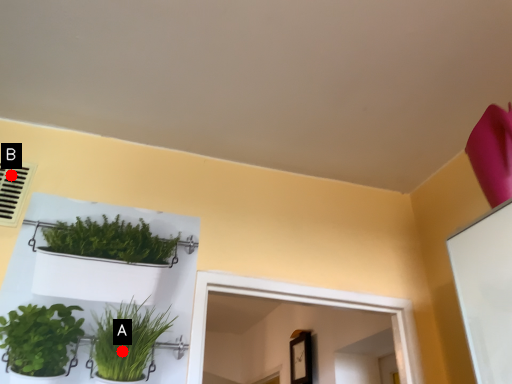
Question: Two points are circled on the image, labeled by A and B beside each circle. Which point is closer to the camera?

Choices:
 (A) A is closer
 (B) B is closer

Answer: (A)